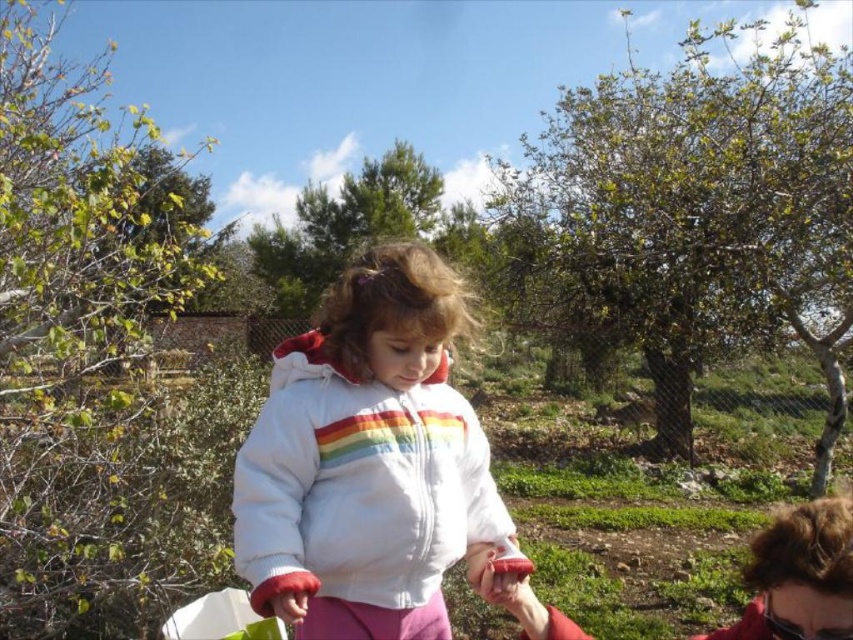
Is point (374, 449) behind point (804, 557)?

That is True.

Is white fleece jacket at center shorter than matte red sweater at lower right?

No, white fleece jacket at center is not shorter than matte red sweater at lower right.

Find the location of a particular element. The image size is (853, 640). white fleece jacket at center is located at coordinates (367, 460).

Locate an element on the screen. The width and height of the screenshot is (853, 640). white fleece jacket at center is located at coordinates (367, 460).